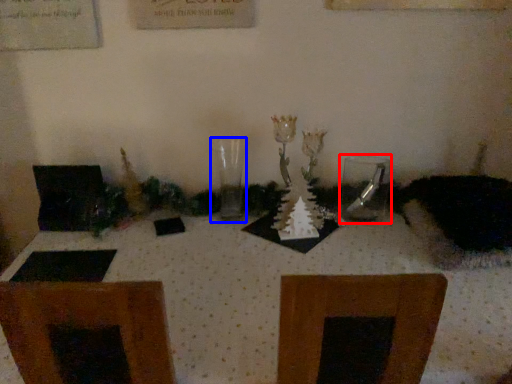
Question: Which of the following is the closest to the observer, tableware (highlighted by a red box) or candle holder (highlighted by a blue box)?

Choices:
 (A) tableware
 (B) candle holder

Answer: (B)